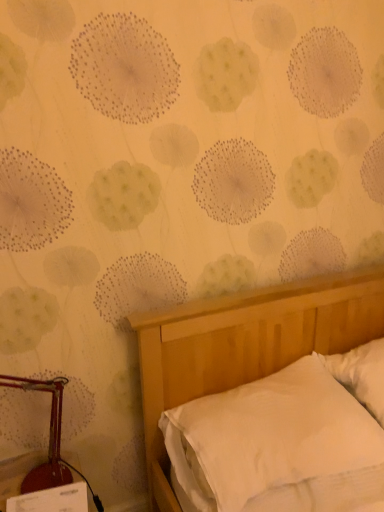
Question: In terms of height, does white soft pillow at right look taller or shorter compared to metallic red lamp at left?

Choices:
 (A) short
 (B) tall

Answer: (A)

Question: Based on their positions, is white soft pillow at right located to the left or right of metallic red lamp at left?

Choices:
 (A) left
 (B) right

Answer: (B)

Question: Which object is positioned farthest from the white soft pillow at right?

Choices:
 (A) white smooth bed at lower right
 (B) metallic red lamp at left

Answer: (B)

Question: Estimate the real-world distances between objects in this image. Which object is farther from the white soft pillow at right?

Choices:
 (A) metallic red lamp at left
 (B) white smooth bed at lower right

Answer: (A)